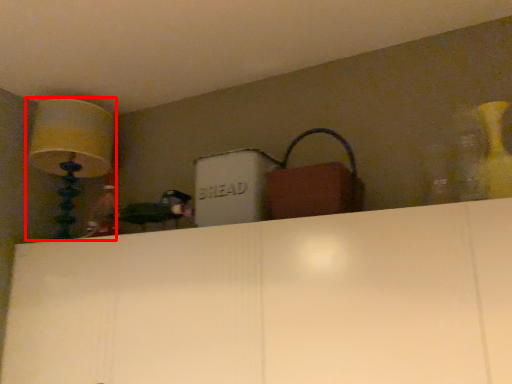
Question: Considering the relative positions of lamp (annotated by the red box) and handbag in the image provided, where is lamp (annotated by the red box) located with respect to the staircase?

Choices:
 (A) right
 (B) left

Answer: (B)